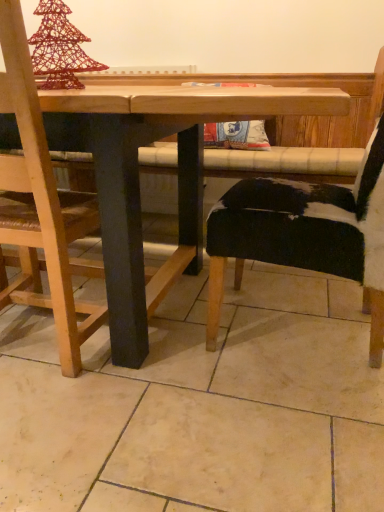
This screenshot has height=512, width=384. Find the location of `free point below black cowhide chair at right, which is counted as the first chair, starting from the right (from a real-world perspective)`. free point below black cowhide chair at right, which is counted as the first chair, starting from the right (from a real-world perspective) is located at coordinates (337, 337).